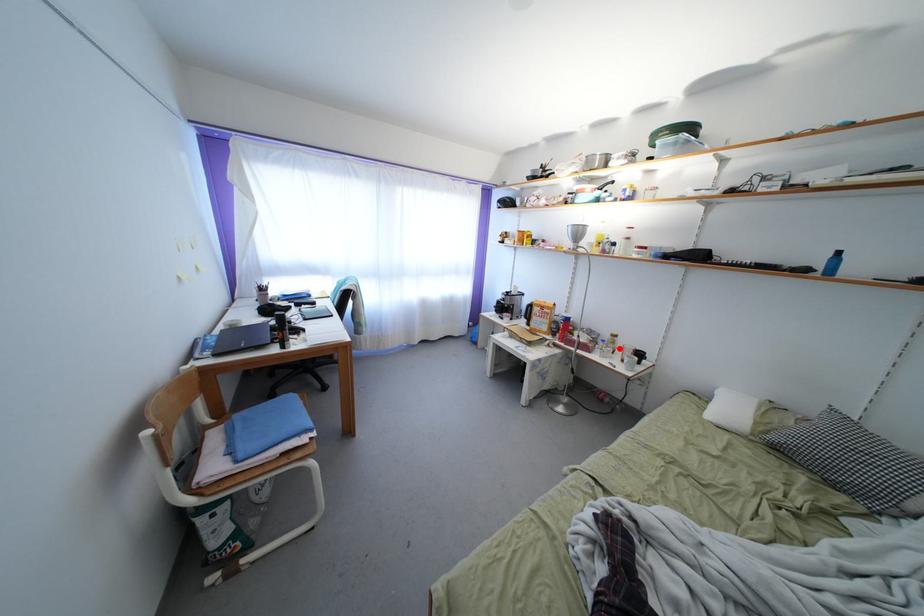
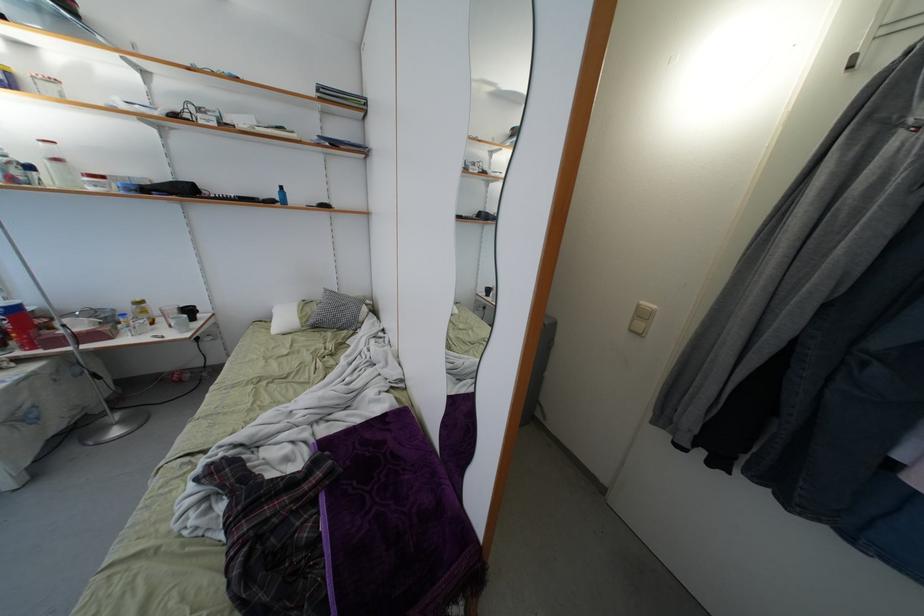
The point at the highlighted location is marked in the first image. Where is the corresponding point in the second image?

(149, 317)